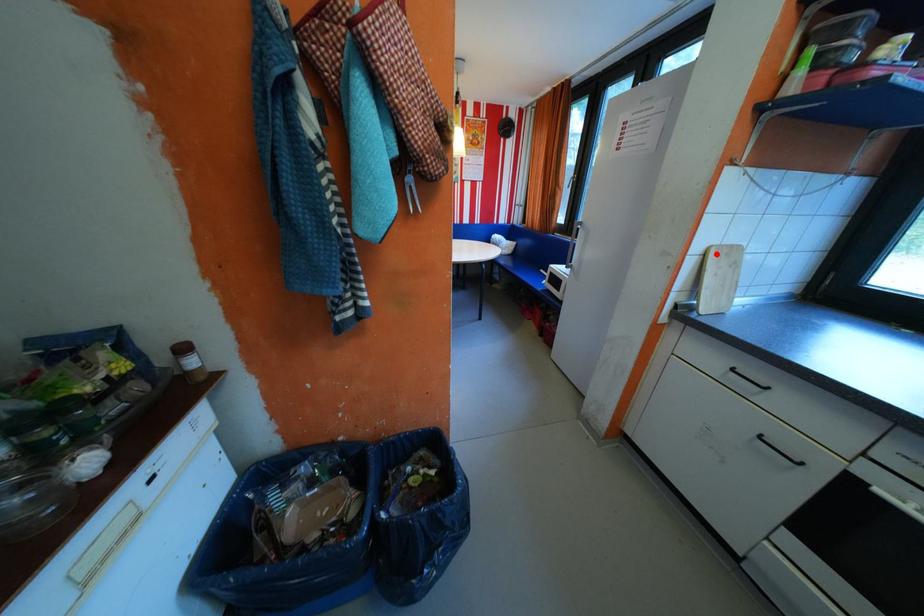
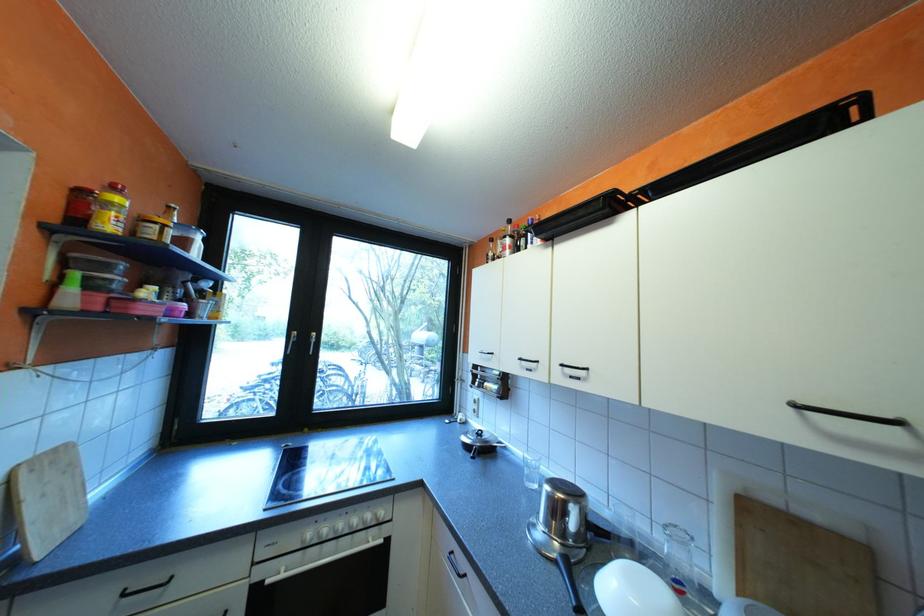
In the second image, find the point that corresponds to the highlighted location in the first image.

(20, 482)